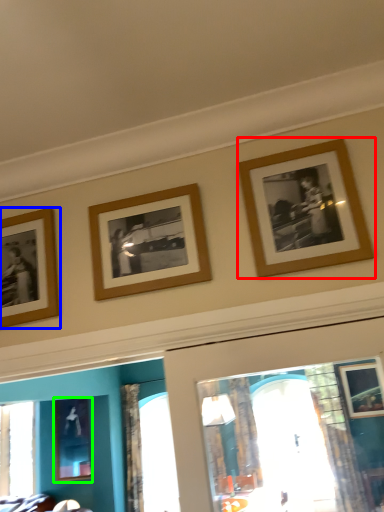
Question: Estimate the real-world distances between objects in this image. Which object is farther from picture frame (highlighted by a red box), picture frame (highlighted by a blue box) or picture frame (highlighted by a green box)?

Choices:
 (A) picture frame
 (B) picture frame

Answer: (B)